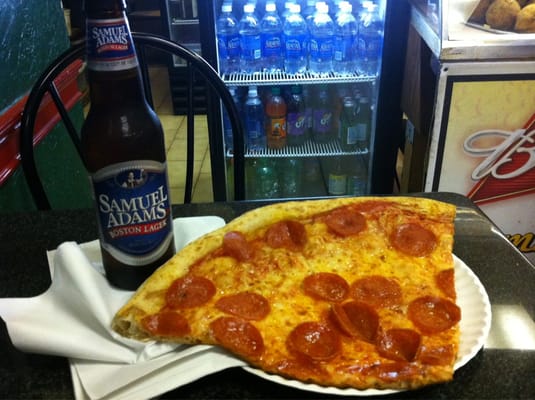
At what (x,y) coordinates should I click in order to perform the action: click on beverage refrigerator. Please return your answer as a coordinate pair (x, y). Image resolution: width=535 pixels, height=400 pixels. Looking at the image, I should click on (324, 56).